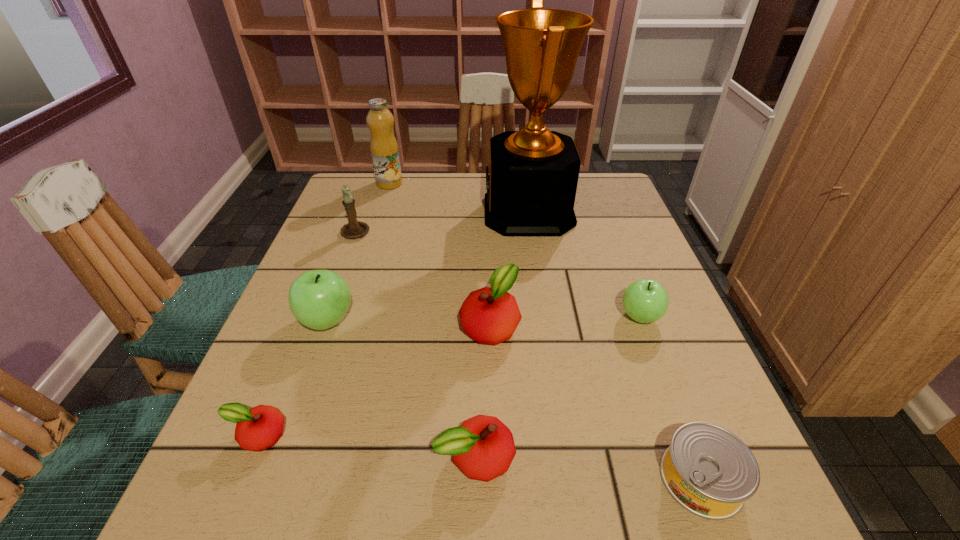
Locate an element on the screen. free point that satisfies the following two spatial constraints: 1. on the front label of the second tallest object; 2. on the left side of the right green apple is located at coordinates (348, 317).

The width and height of the screenshot is (960, 540). I want to click on vacant point that satisfies the following two spatial constraints: 1. on the back side of the leftmost red apple; 2. on the right side of the rightmost apple, so click(307, 317).

In order to click on free spot that satisfies the following two spatial constraints: 1. on the front side of the silver can; 2. on the left side of the second biggest red apple in this screenshot , I will do [x=475, y=478].